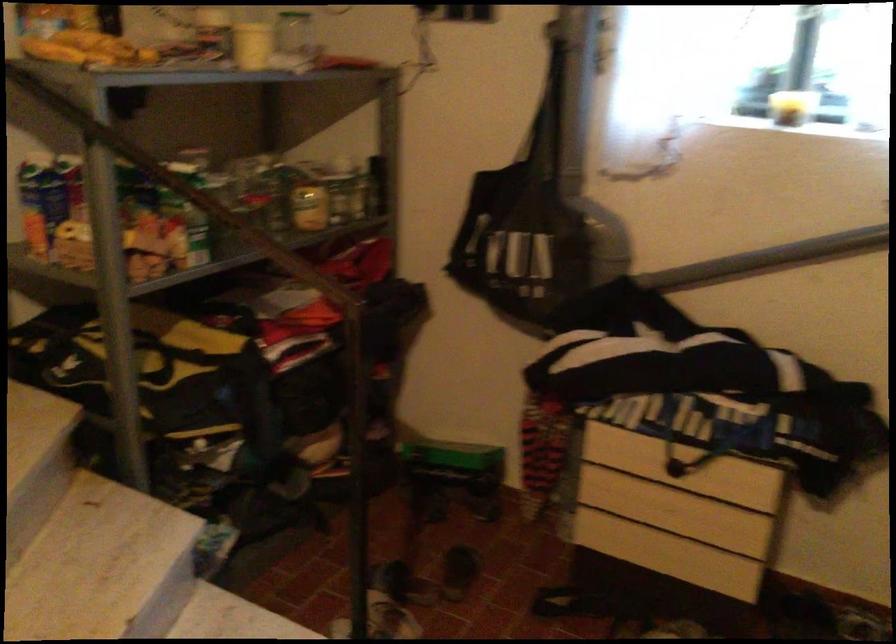
Question: Based on the continuous images, in which direction is the camera rotating? Reply with the corresponding letter.

Choices:
 (A) Left
 (B) Right
 (C) Up
 (D) Down

Answer: (B)